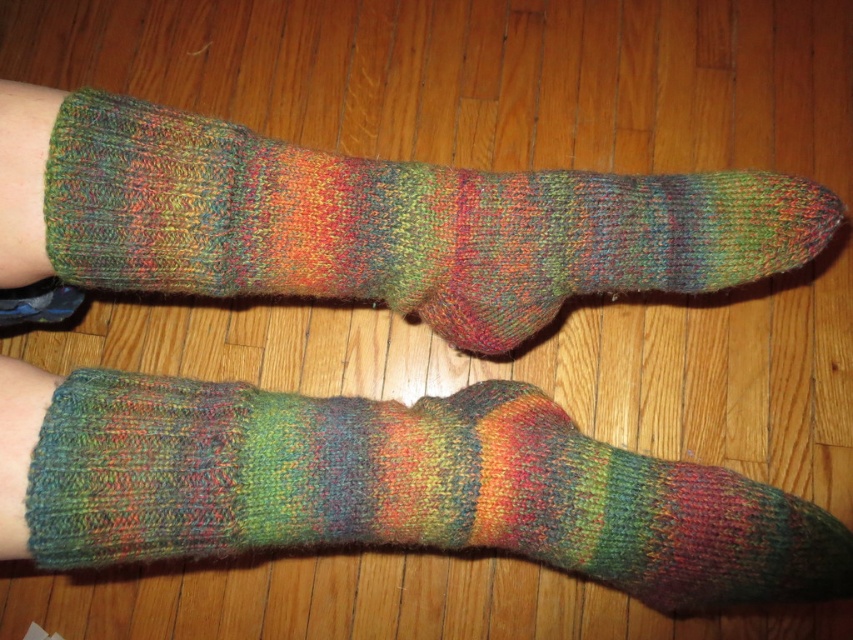
Question: Which point appears closest to the camera in this image?

Choices:
 (A) (242, 465)
 (B) (291, 202)

Answer: (A)

Question: Can you confirm if multicolored knitted sock at lower left is positioned to the right of multicolored knitted sock at upper center?

Choices:
 (A) no
 (B) yes

Answer: (A)

Question: Does multicolored knitted sock at lower left have a larger size compared to multicolored knitted sock at upper center?

Choices:
 (A) yes
 (B) no

Answer: (B)

Question: Can you confirm if multicolored knitted sock at lower left is wider than multicolored knitted sock at upper center?

Choices:
 (A) no
 (B) yes

Answer: (A)

Question: Which point appears farthest from the camera in this image?

Choices:
 (A) (506, 522)
 (B) (129, 138)

Answer: (A)

Question: Among these objects, which one is farthest from the camera?

Choices:
 (A) multicolored knitted sock at lower left
 (B) multicolored knitted sock at upper center

Answer: (B)